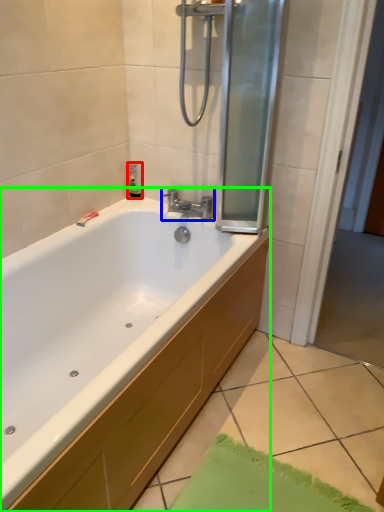
Question: Which is farther away from toiletry (highlighted by a red box)? tap (highlighted by a blue box) or bathtub (highlighted by a green box)?

Choices:
 (A) tap
 (B) bathtub

Answer: (B)